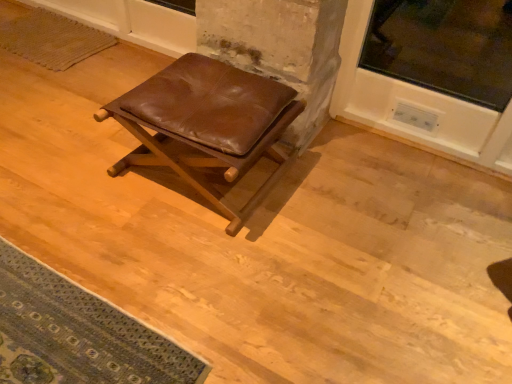
Identify the location of vacant space in front of brown leather stool at center. The height and width of the screenshot is (384, 512). (180, 271).